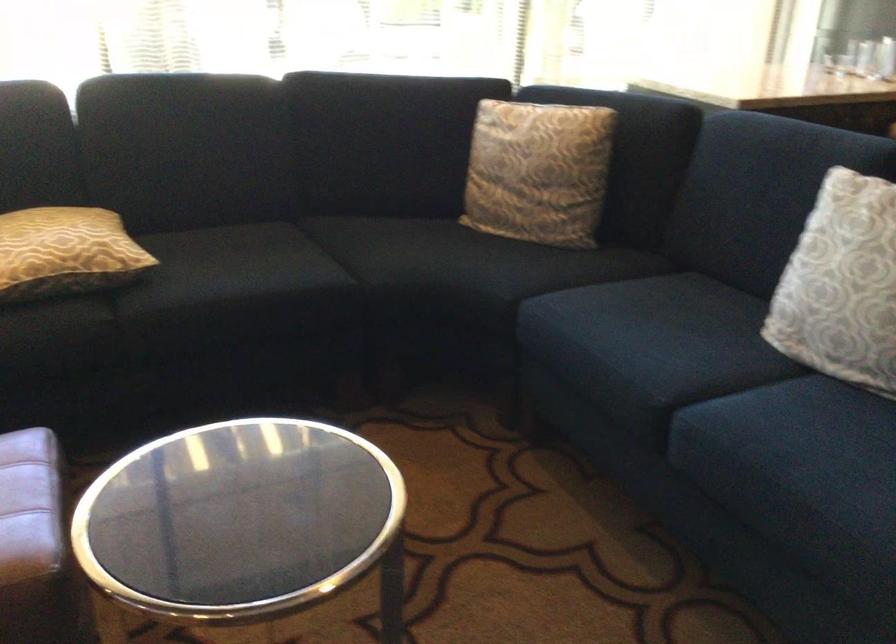
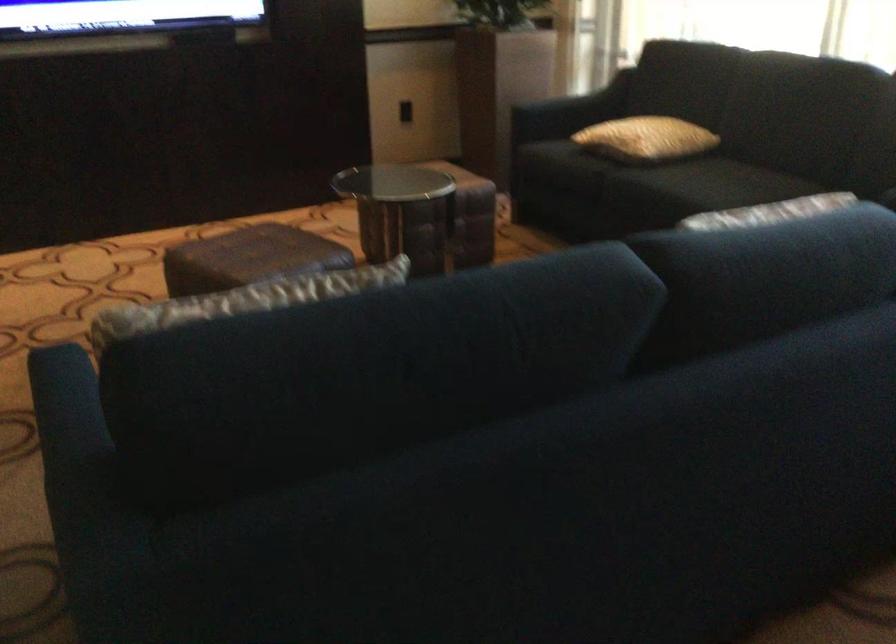
In the second image, find the point that corresponds to point (273, 265) in the first image.

(709, 184)